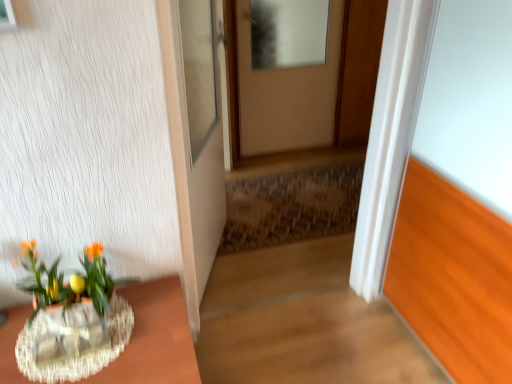
Question: Which direction should I rotate to look at matte beige door at center, placed as the 1th door when sorted from right to left, — up or down?

Choices:
 (A) down
 (B) up

Answer: (B)

Question: Is translucent glass vase at lower left far from rustic wooden stairwell at center?

Choices:
 (A) yes
 (B) no

Answer: (A)

Question: Is translucent glass vase at lower left in front of rustic wooden stairwell at center?

Choices:
 (A) no
 (B) yes

Answer: (B)

Question: Is translucent glass vase at lower left positioned behind rustic wooden stairwell at center?

Choices:
 (A) yes
 (B) no

Answer: (B)

Question: Considering the relative sizes of translucent glass vase at lower left and rustic wooden stairwell at center in the image provided, is translucent glass vase at lower left taller than rustic wooden stairwell at center?

Choices:
 (A) no
 (B) yes

Answer: (A)

Question: Is rustic wooden stairwell at center surrounded by translucent glass vase at lower left?

Choices:
 (A) no
 (B) yes

Answer: (A)

Question: From the image's perspective, is translucent glass vase at lower left below rustic wooden stairwell at center?

Choices:
 (A) no
 (B) yes

Answer: (B)

Question: Considering the relative sizes of clear glass vase at lower left and white glossy door at center, placed as the 1th door when sorted from front to back, in the image provided, is clear glass vase at lower left thinner than white glossy door at center, placed as the 1th door when sorted from front to back,?

Choices:
 (A) yes
 (B) no

Answer: (B)

Question: Considering the relative positions of clear glass vase at lower left and white glossy door at center, which appears as the 2th door when viewed from the back, in the image provided, is clear glass vase at lower left to the right of white glossy door at center, which appears as the 2th door when viewed from the back, from the viewer's perspective?

Choices:
 (A) yes
 (B) no

Answer: (B)

Question: From a real-world perspective, does clear glass vase at lower left sit lower than white glossy door at center, which ranks as the 2th door in right-to-left order?

Choices:
 (A) no
 (B) yes

Answer: (B)

Question: Would you say white glossy door at center, which ranks as the 2th door in right-to-left order, is part of clear glass vase at lower left's contents?

Choices:
 (A) no
 (B) yes

Answer: (A)

Question: Is clear glass vase at lower left completely or partially outside of white glossy door at center, which appears as the 2th door when viewed from the back?

Choices:
 (A) yes
 (B) no

Answer: (A)

Question: Is clear glass vase at lower left in front of white glossy door at center, which appears as the 2th door when viewed from the back?

Choices:
 (A) no
 (B) yes

Answer: (B)

Question: Is white glossy door at center, placed as the 1th door when sorted from front to back, positioned far away from rustic wooden stairwell at center?

Choices:
 (A) no
 (B) yes

Answer: (A)